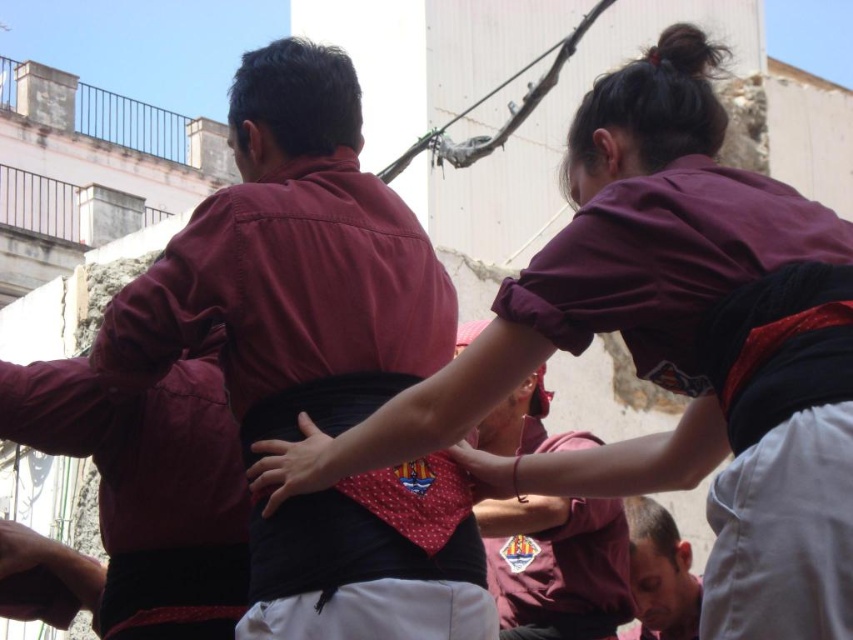
Question: Which object is the farthest from the polka dot fabric hand at center?

Choices:
 (A) matte maroon shirt at upper center
 (B) smooth skin face at lower center
 (C) smooth skin hand at center

Answer: (B)

Question: Which point appears farthest from the camera in this image?

Choices:
 (A) tap(641, 637)
 (B) tap(469, 634)
 (C) tap(323, 456)
 (D) tap(511, 506)

Answer: (A)

Question: Is smooth skin face at lower center closer to the viewer compared to smooth skin hand at center?

Choices:
 (A) no
 (B) yes

Answer: (A)

Question: Can you confirm if maroon fabric shirt at center is smaller than smooth skin hand at center?

Choices:
 (A) no
 (B) yes

Answer: (A)

Question: Observing the image, what is the correct spatial positioning of matte maroon shirt at upper center in reference to polka dot fabric hand at center?

Choices:
 (A) below
 (B) above

Answer: (B)

Question: Which of the following is the farthest from the observer?

Choices:
 (A) (189, 266)
 (B) (486, 468)
 (C) (665, 554)

Answer: (C)